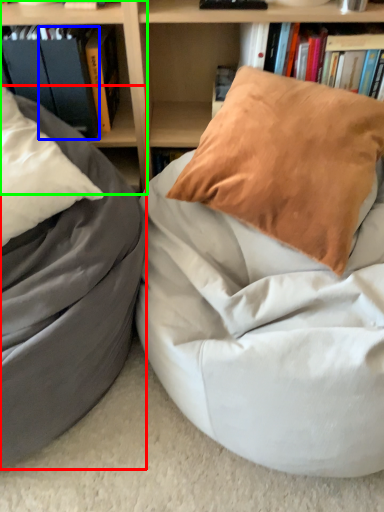
Question: Which object is the farthest from bean bag chair (highlighted by a red box)? Choose among these: paperback book (highlighted by a blue box) or shelf (highlighted by a green box).

Choices:
 (A) paperback book
 (B) shelf

Answer: (B)